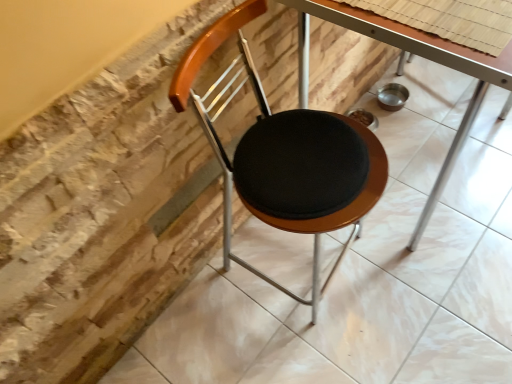
Where is `vacant area that is in front of matte black seat at center`? This screenshot has width=512, height=384. vacant area that is in front of matte black seat at center is located at coordinates (333, 350).